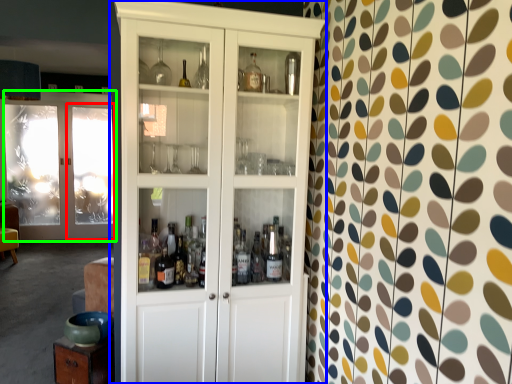
Question: Estimate the real-world distances between objects in this image. Which object is closer to screen door (highlighted by a red box), cupboard (highlighted by a blue box) or door (highlighted by a green box)?

Choices:
 (A) cupboard
 (B) door

Answer: (B)